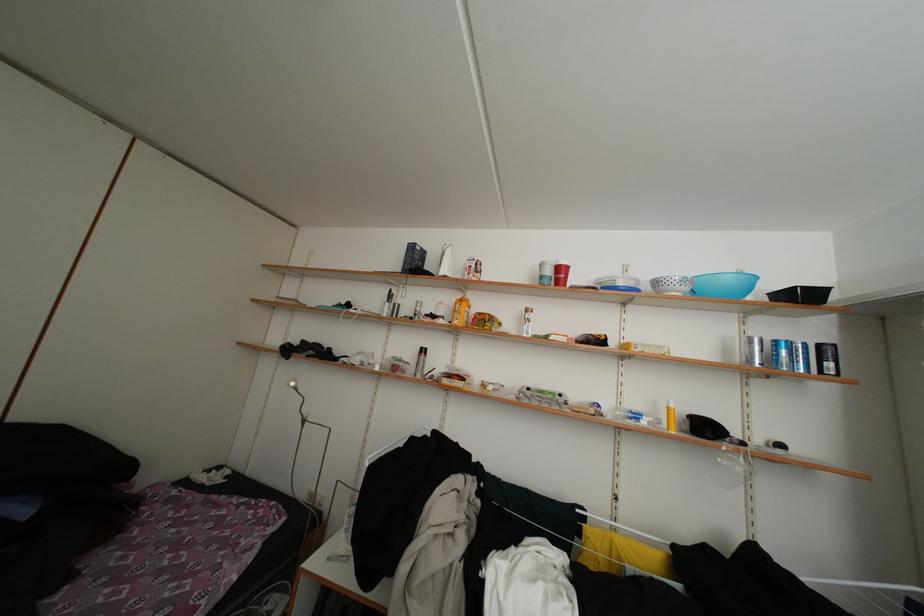
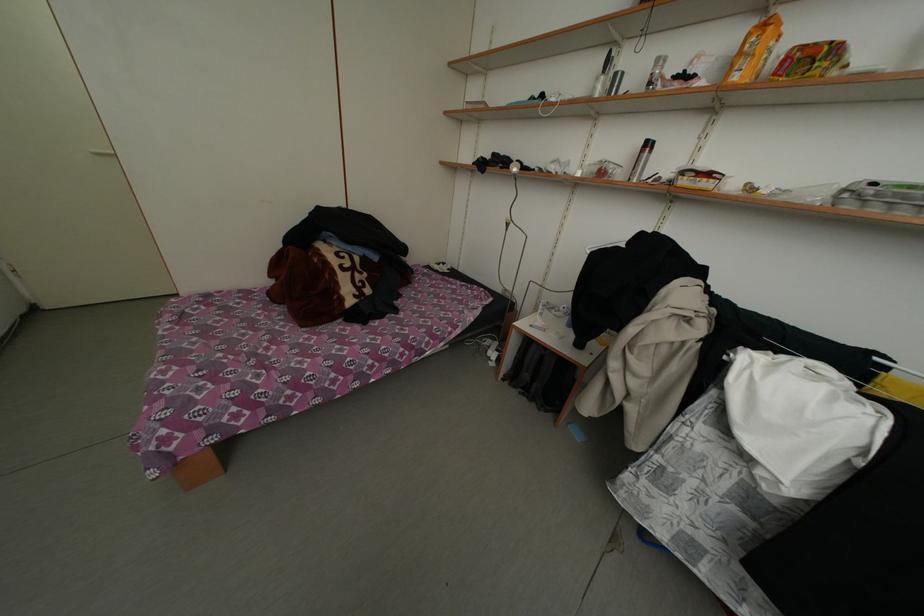
First-person continuous shooting, in which direction is the camera rotating?

The camera's rotation is toward left-down.